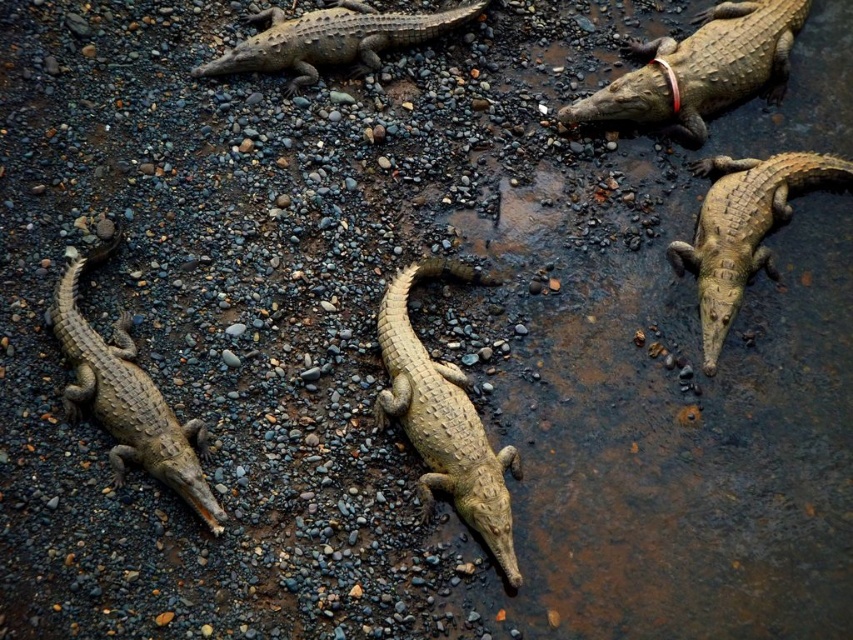
You are a wildlife photographer trying to capture a closeup shot of the light brown textured skin at upper center. However, there is a leathery brown crocodile at lower left blocking your view. Can you determine if the crocodile is smaller or bigger than the skin texture area you want to photograph?

The leathery brown crocodile at lower left is bigger than the light brown textured skin at upper center, so the crocodile is larger and may block the view of the skin texture area.

You are a wildlife photographer aiming to capture a closeup of the leathery brown crocodile at lower left. You are currently standing at point (128, 397). Is there any obstacle between you and the crocodile?

There is no obstacle between you and the leathery brown crocodile at lower left because the point (128, 397) is exactly where the crocodile is located.